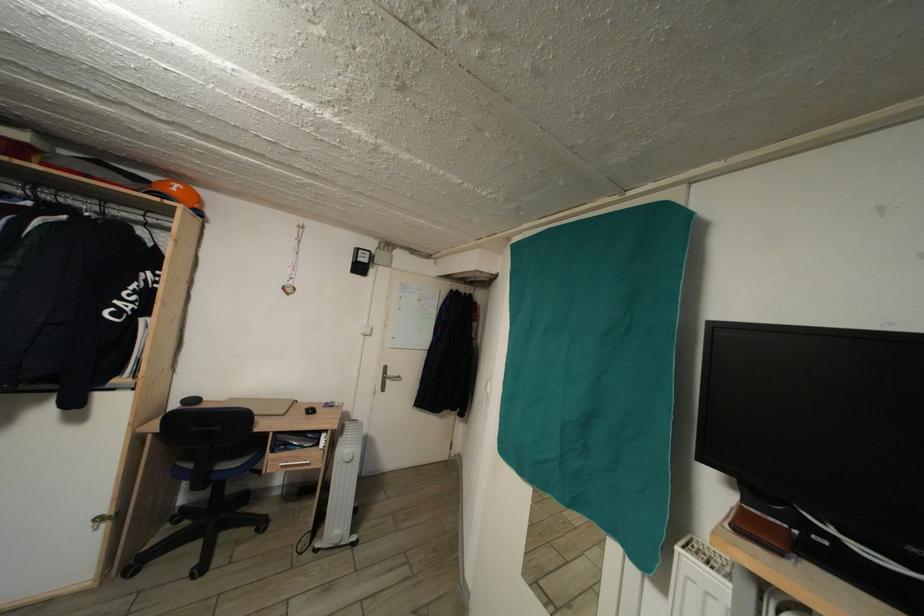
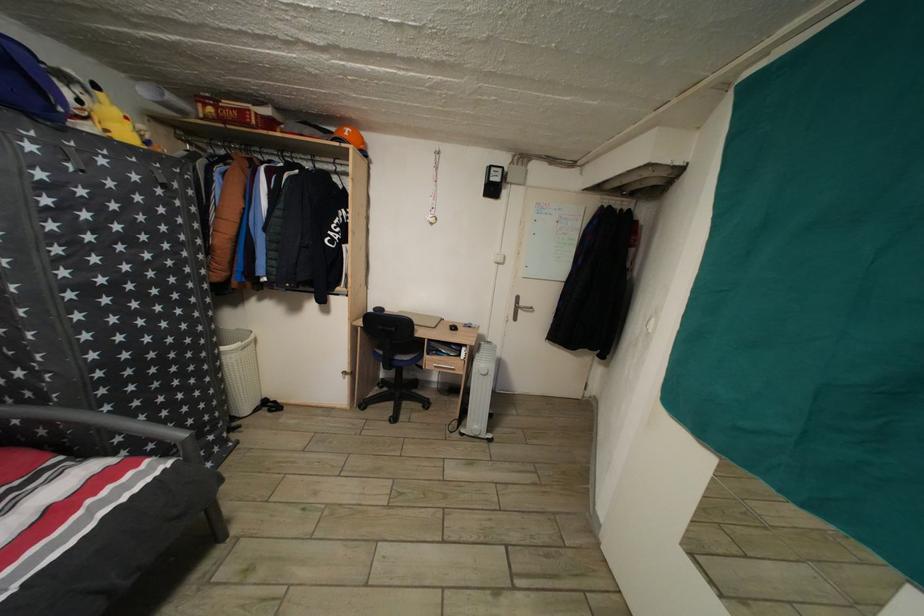
The point at (353, 456) is marked in the first image. Where is the corresponding point in the second image?

(489, 371)